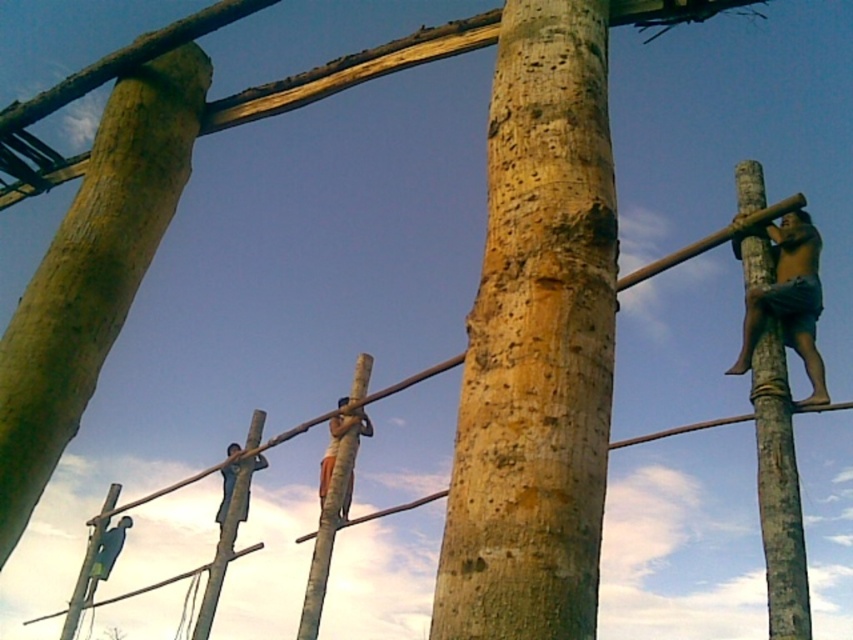
You are a climber on the wooden structure and need to move from point A to point B. Point A is at coordinates point (315, 538) and point B is at coordinates point (257, 465). Based on the scene description, which direction should you move to reach point B from point A?

To reach point B from point A, you should move backward since point A is in front of point B according to their coordinates.

You are planning to climb the structure and need to choose the tallest pole to start your ascent. Based on the scene, which pole should you choose between the natural wood pole at center and the wooden pole at center?

The natural wood pole at center is taller than the wooden pole at center, so you should choose the natural wood pole at center to start your ascent.

You are a climber trying to reach the top of the wooden structure. There is a point marked at coordinates (537, 342). What object is located at that point?

The point at coordinates (537, 342) corresponds to the natural wood pole at center.